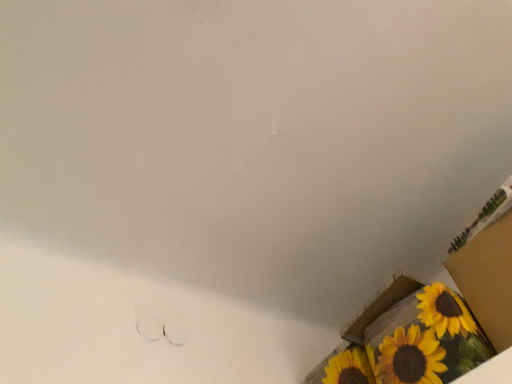
The height and width of the screenshot is (384, 512). I want to click on yellow painted cardboard box at lower right, which ranks as the 1th cardboard box in bottom-to-top order, so click(408, 339).

Looking at this image, what is the approximate width of yellow painted cardboard box at lower right, the 2th cardboard box positioned from the top?

The width of yellow painted cardboard box at lower right, the 2th cardboard box positioned from the top, is 22.05 inches.

This screenshot has height=384, width=512. What do you see at coordinates (408, 339) in the screenshot? I see `yellow painted cardboard box at lower right, which ranks as the 1th cardboard box in bottom-to-top order` at bounding box center [408, 339].

This screenshot has height=384, width=512. Describe the element at coordinates (487, 279) in the screenshot. I see `cardboard box at lower right, marked as the 1th cardboard box in a top-to-bottom arrangement` at that location.

Image resolution: width=512 pixels, height=384 pixels. What are the coordinates of `cardboard box at lower right, the 2th cardboard box when ordered from bottom to top` in the screenshot? It's located at (487, 279).

How much space does cardboard box at lower right, marked as the 1th cardboard box in a top-to-bottom arrangement, occupy horizontally?

The width of cardboard box at lower right, marked as the 1th cardboard box in a top-to-bottom arrangement, is 17.78 inches.

Image resolution: width=512 pixels, height=384 pixels. What are the coordinates of `yellow painted cardboard box at lower right, which ranks as the 1th cardboard box in bottom-to-top order` in the screenshot? It's located at (408, 339).

Considering the positions of objects cardboard box at lower right, marked as the 1th cardboard box in a top-to-bottom arrangement, and yellow painted cardboard box at lower right, the 2th cardboard box positioned from the top, in the image provided, who is more to the left, cardboard box at lower right, marked as the 1th cardboard box in a top-to-bottom arrangement, or yellow painted cardboard box at lower right, the 2th cardboard box positioned from the top,?

yellow painted cardboard box at lower right, the 2th cardboard box positioned from the top.

Between cardboard box at lower right, marked as the 1th cardboard box in a top-to-bottom arrangement, and yellow painted cardboard box at lower right, the 2th cardboard box positioned from the top, which one is positioned in front?

Positioned in front is cardboard box at lower right, marked as the 1th cardboard box in a top-to-bottom arrangement.

Which is less distant, [508,254] or [399,356]?

Point [508,254] is closer to the camera than point [399,356].

From the image's perspective, is cardboard box at lower right, the 2th cardboard box when ordered from bottom to top, over yellow painted cardboard box at lower right, which ranks as the 1th cardboard box in bottom-to-top order?

Yes, from the image's perspective, cardboard box at lower right, the 2th cardboard box when ordered from bottom to top, is over yellow painted cardboard box at lower right, which ranks as the 1th cardboard box in bottom-to-top order.

From a real-world perspective, between cardboard box at lower right, the 2th cardboard box when ordered from bottom to top, and yellow painted cardboard box at lower right, which ranks as the 1th cardboard box in bottom-to-top order, who is vertically lower?

From a 3D spatial view, yellow painted cardboard box at lower right, which ranks as the 1th cardboard box in bottom-to-top order, is below.

Does cardboard box at lower right, the 2th cardboard box when ordered from bottom to top, have a lesser width compared to yellow painted cardboard box at lower right, which ranks as the 1th cardboard box in bottom-to-top order?

Indeed, cardboard box at lower right, the 2th cardboard box when ordered from bottom to top, has a lesser width compared to yellow painted cardboard box at lower right, which ranks as the 1th cardboard box in bottom-to-top order.

Is cardboard box at lower right, the 2th cardboard box when ordered from bottom to top, taller than yellow painted cardboard box at lower right, the 2th cardboard box positioned from the top?

Correct, cardboard box at lower right, the 2th cardboard box when ordered from bottom to top, is much taller as yellow painted cardboard box at lower right, the 2th cardboard box positioned from the top.

Is cardboard box at lower right, the 2th cardboard box when ordered from bottom to top, smaller than yellow painted cardboard box at lower right, which ranks as the 1th cardboard box in bottom-to-top order?

Yes.

Is yellow painted cardboard box at lower right, which ranks as the 1th cardboard box in bottom-to-top order, surrounded by cardboard box at lower right, marked as the 1th cardboard box in a top-to-bottom arrangement?

No, yellow painted cardboard box at lower right, which ranks as the 1th cardboard box in bottom-to-top order, is not inside cardboard box at lower right, marked as the 1th cardboard box in a top-to-bottom arrangement.

Is cardboard box at lower right, marked as the 1th cardboard box in a top-to-bottom arrangement, directly adjacent to yellow painted cardboard box at lower right, which ranks as the 1th cardboard box in bottom-to-top order?

No.

In the scene shown: Is cardboard box at lower right, the 2th cardboard box when ordered from bottom to top, oriented towards yellow painted cardboard box at lower right, the 2th cardboard box positioned from the top?

No, cardboard box at lower right, the 2th cardboard box when ordered from bottom to top, does not turn towards yellow painted cardboard box at lower right, the 2th cardboard box positioned from the top.

In the image, there is a cardboard box at lower right, the 2th cardboard box when ordered from bottom to top. Find the location of `cardboard box below it (from the image's perspective)`. cardboard box below it (from the image's perspective) is located at coordinates (408, 339).

Considering the relative positions of yellow painted cardboard box at lower right, which ranks as the 1th cardboard box in bottom-to-top order, and cardboard box at lower right, marked as the 1th cardboard box in a top-to-bottom arrangement, in the image provided, is yellow painted cardboard box at lower right, which ranks as the 1th cardboard box in bottom-to-top order, to the left or to the right of cardboard box at lower right, marked as the 1th cardboard box in a top-to-bottom arrangement,?

In the image, yellow painted cardboard box at lower right, which ranks as the 1th cardboard box in bottom-to-top order, appears on the left side of cardboard box at lower right, marked as the 1th cardboard box in a top-to-bottom arrangement.

Is yellow painted cardboard box at lower right, the 2th cardboard box positioned from the top, in front of or behind cardboard box at lower right, the 2th cardboard box when ordered from bottom to top, in the image?

Visually, yellow painted cardboard box at lower right, the 2th cardboard box positioned from the top, is located behind cardboard box at lower right, the 2th cardboard box when ordered from bottom to top.

Does point (315, 369) appear closer or farther from the camera than point (502, 216)?

Point (315, 369) is positioned farther from the camera compared to point (502, 216).

From the image's perspective, which is above, yellow painted cardboard box at lower right, which ranks as the 1th cardboard box in bottom-to-top order, or cardboard box at lower right, the 2th cardboard box when ordered from bottom to top?

From the image's view, cardboard box at lower right, the 2th cardboard box when ordered from bottom to top, is above.

From a real-world perspective, is yellow painted cardboard box at lower right, which ranks as the 1th cardboard box in bottom-to-top order, located beneath cardboard box at lower right, marked as the 1th cardboard box in a top-to-bottom arrangement?

Yes, from a real-world perspective, yellow painted cardboard box at lower right, which ranks as the 1th cardboard box in bottom-to-top order, is beneath cardboard box at lower right, marked as the 1th cardboard box in a top-to-bottom arrangement.

Which object is thinner, yellow painted cardboard box at lower right, the 2th cardboard box positioned from the top, or cardboard box at lower right, marked as the 1th cardboard box in a top-to-bottom arrangement?

cardboard box at lower right, marked as the 1th cardboard box in a top-to-bottom arrangement, is thinner.

Who is shorter, yellow painted cardboard box at lower right, the 2th cardboard box positioned from the top, or cardboard box at lower right, marked as the 1th cardboard box in a top-to-bottom arrangement?

yellow painted cardboard box at lower right, the 2th cardboard box positioned from the top, is shorter.

Who is bigger, yellow painted cardboard box at lower right, which ranks as the 1th cardboard box in bottom-to-top order, or cardboard box at lower right, the 2th cardboard box when ordered from bottom to top?

Bigger between the two is yellow painted cardboard box at lower right, which ranks as the 1th cardboard box in bottom-to-top order.

Is cardboard box at lower right, the 2th cardboard box when ordered from bottom to top, completely or partially inside yellow painted cardboard box at lower right, which ranks as the 1th cardboard box in bottom-to-top order?

That's incorrect, cardboard box at lower right, the 2th cardboard box when ordered from bottom to top, is not inside yellow painted cardboard box at lower right, which ranks as the 1th cardboard box in bottom-to-top order.

Are yellow painted cardboard box at lower right, which ranks as the 1th cardboard box in bottom-to-top order, and cardboard box at lower right, the 2th cardboard box when ordered from bottom to top, far apart?

No, there isn't a large distance between yellow painted cardboard box at lower right, which ranks as the 1th cardboard box in bottom-to-top order, and cardboard box at lower right, the 2th cardboard box when ordered from bottom to top.

Does yellow painted cardboard box at lower right, the 2th cardboard box positioned from the top, turn towards cardboard box at lower right, the 2th cardboard box when ordered from bottom to top?

No, yellow painted cardboard box at lower right, the 2th cardboard box positioned from the top, is not aimed at cardboard box at lower right, the 2th cardboard box when ordered from bottom to top.

What's the angular difference between yellow painted cardboard box at lower right, which ranks as the 1th cardboard box in bottom-to-top order, and cardboard box at lower right, the 2th cardboard box when ordered from bottom to top,'s facing directions?

There is a 0.00019-degree angle between the facing directions of yellow painted cardboard box at lower right, which ranks as the 1th cardboard box in bottom-to-top order, and cardboard box at lower right, the 2th cardboard box when ordered from bottom to top.

Could you measure the distance between yellow painted cardboard box at lower right, which ranks as the 1th cardboard box in bottom-to-top order, and cardboard box at lower right, marked as the 1th cardboard box in a top-to-bottom arrangement?

The distance of yellow painted cardboard box at lower right, which ranks as the 1th cardboard box in bottom-to-top order, from cardboard box at lower right, marked as the 1th cardboard box in a top-to-bottom arrangement, is 17.92 centimeters.

I want to click on cardboard box that appears above the yellow painted cardboard box at lower right, the 2th cardboard box positioned from the top (from a real-world perspective), so point(487,279).

The height and width of the screenshot is (384, 512). Find the location of `cardboard box in front of the yellow painted cardboard box at lower right, the 2th cardboard box positioned from the top`. cardboard box in front of the yellow painted cardboard box at lower right, the 2th cardboard box positioned from the top is located at coordinates (487, 279).

This screenshot has width=512, height=384. What are the coordinates of `cardboard box located above the yellow painted cardboard box at lower right, the 2th cardboard box positioned from the top (from a real-world perspective)` in the screenshot? It's located at (487, 279).